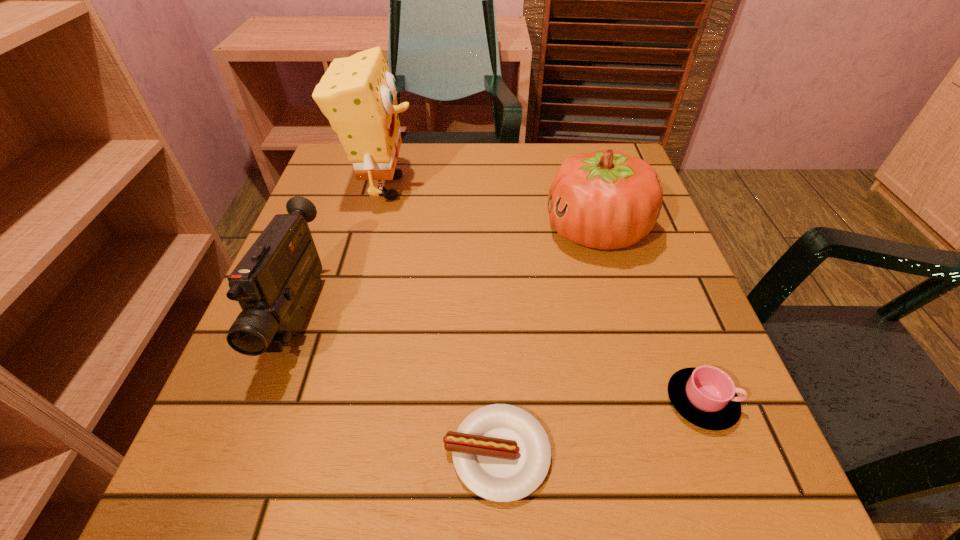
Locate an element on the screen. sponge is located at coordinates (358, 94).

I want to click on pumpkin, so pyautogui.click(x=606, y=199).

This screenshot has height=540, width=960. I want to click on camcorder, so click(x=275, y=283).

Identify the location of cup. (706, 396).

Where is `sausage`? This screenshot has width=960, height=540. sausage is located at coordinates (501, 453).

This screenshot has height=540, width=960. In order to click on the third object from right to left in this screenshot , I will do `click(501, 453)`.

Find the location of a particular element. This screenshot has height=540, width=960. vacant space located 0.260m on the face of the sponge is located at coordinates (529, 186).

Where is `vacant space located 0.240m on the side of the pumpkin with the cute face`? vacant space located 0.240m on the side of the pumpkin with the cute face is located at coordinates (432, 231).

I want to click on vacant area situated on the side of the pumpkin with the cute face, so click(x=442, y=231).

Identify the location of free location located on the side of the pumpkin with the cute face. This screenshot has height=540, width=960. (365, 231).